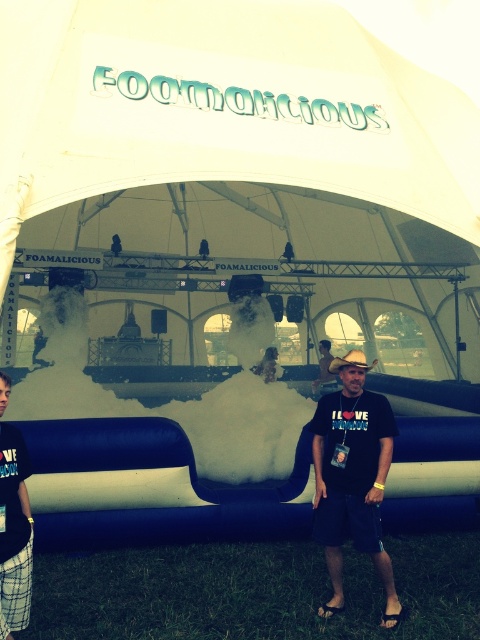
You are organizing a photo shoot and need to place a 3D model of a hat and a pair of shorts in the scene. The model hat is 12 inches wide and the model shorts are 8 inches wide. According to the scene description, will the sizes of the 3D models match the proportions between the plaid shorts at lower left and the brown straw hat at center?

The plaid shorts at lower left is less in width than the brown straw hat at center. Since the model shorts are 8 inches and the hat model is 12 inches, the proportions match as the shorts are narrower than the hat.